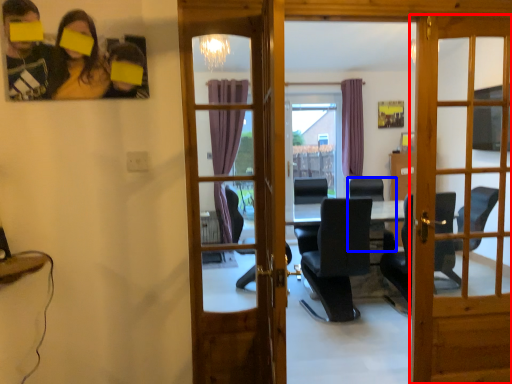
Question: Among these objects, which one is farthest to the camera, door (highlighted by a red box) or chair (highlighted by a blue box)?

Choices:
 (A) door
 (B) chair

Answer: (B)